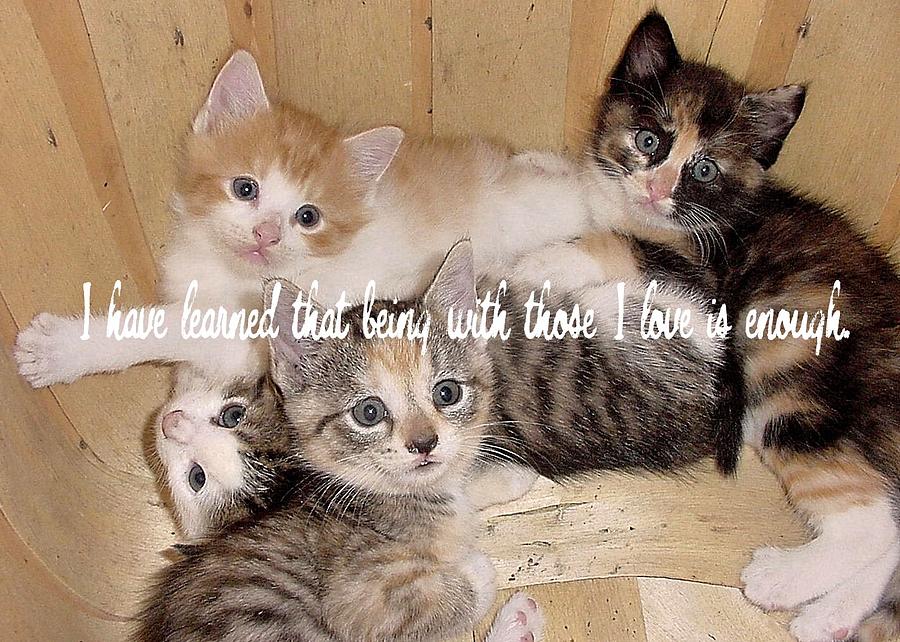
At what (x,y) coordinates should I click in order to perform the action: click on bottom of basket. Please return your answer as a coordinate pair (x, y). Looking at the image, I should click on [598, 526].